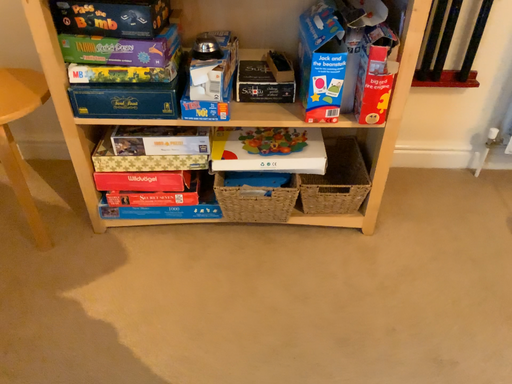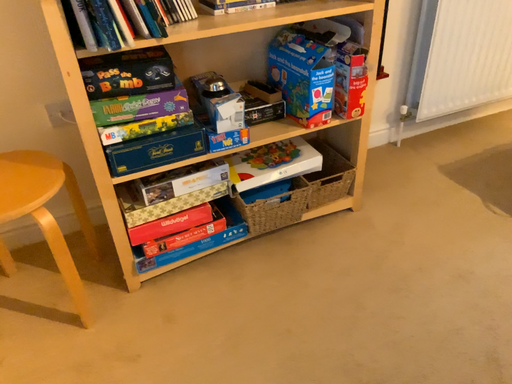
Question: How did the camera likely rotate when shooting the video?

Choices:
 (A) rotated left
 (B) rotated right

Answer: (B)